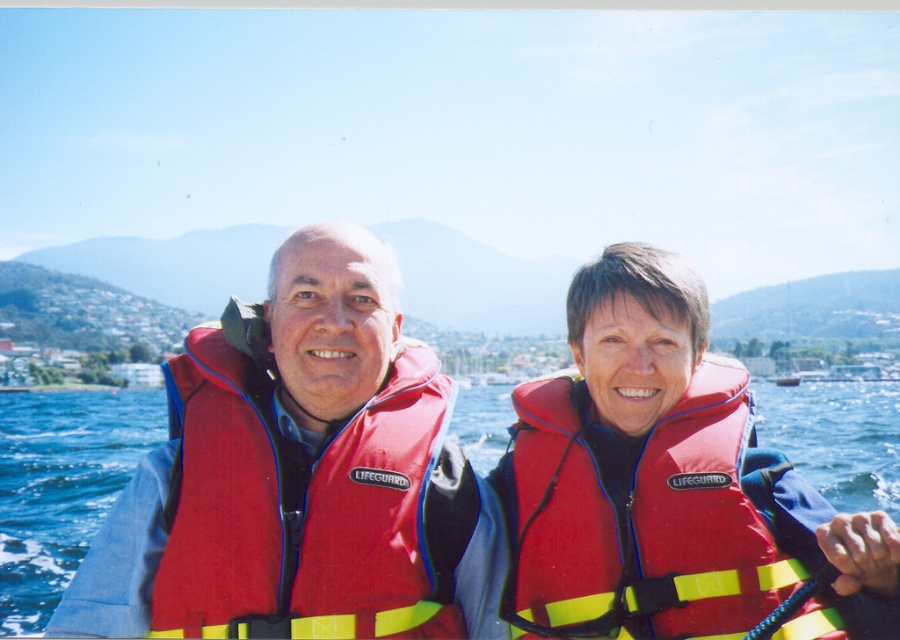
You are a photographer trying to capture a clear shot of both the red life vest at center and the red fabric life jacket at center. Since they are both at the center, which one is more to the right?

The red life vest at center is positioned on the right side of red fabric life jacket at center, so the red life vest at center is more to the right.

In the scene shown: You are a lifeguard trainee who needs to choose between the red life vest at center and the red fabric life jacket at center for a rescue operation. Based on their sizes, which one would you recommend and why?

The red life vest at center has a greater height compared to the red fabric life jacket at center, so it would provide better visibility and buoyancy during a rescue operation. I recommend choosing the red life vest at center.